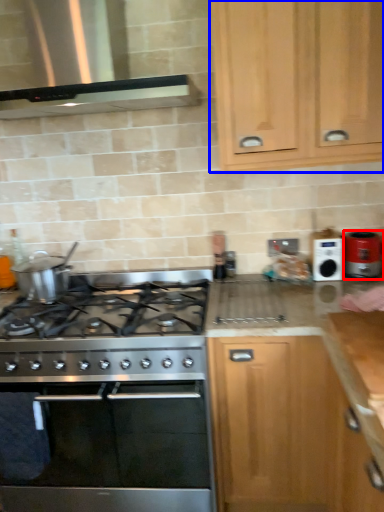
Question: Which point is further to the camera, kitchen appliance (highlighted by a red box) or cabinetry (highlighted by a blue box)?

Choices:
 (A) kitchen appliance
 (B) cabinetry

Answer: (A)